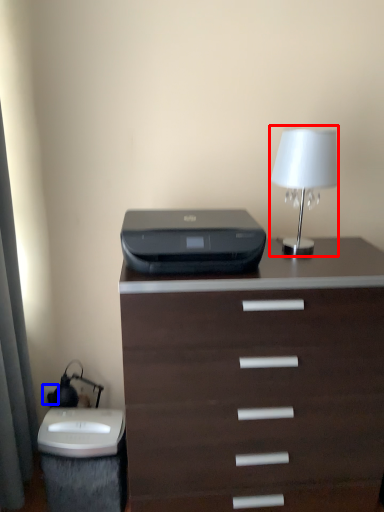
Question: Which of the following is the farthest to the observer, bedside lamp (highlighted by a red box) or electric outlet (highlighted by a blue box)?

Choices:
 (A) bedside lamp
 (B) electric outlet

Answer: (B)